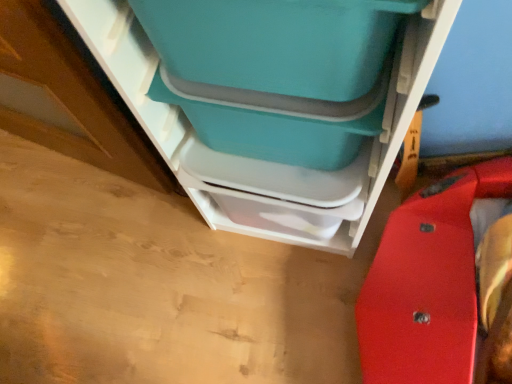
Question: Should I look upward or downward to see matte plastic storage container at center?

Choices:
 (A) down
 (B) up

Answer: (B)

Question: Can you confirm if teal plastic storage bin at upper center is shorter than matte plastic storage container at center?

Choices:
 (A) yes
 (B) no

Answer: (B)

Question: From the image's perspective, is teal plastic storage bin at upper center beneath matte plastic storage container at center?

Choices:
 (A) no
 (B) yes

Answer: (B)

Question: Considering the relative sizes of teal plastic storage bin at upper center and matte plastic storage container at center in the image provided, is teal plastic storage bin at upper center taller than matte plastic storage container at center?

Choices:
 (A) no
 (B) yes

Answer: (B)

Question: Is teal plastic storage bin at upper center at the right side of matte plastic storage container at center?

Choices:
 (A) yes
 (B) no

Answer: (A)

Question: Is teal plastic storage bin at upper center outside matte plastic storage container at center?

Choices:
 (A) yes
 (B) no

Answer: (A)

Question: Is the position of teal plastic storage bin at upper center less distant than that of matte plastic storage container at center?

Choices:
 (A) no
 (B) yes

Answer: (B)

Question: Can you confirm if matte plastic storage container at center is wider than teal plastic storage bin at upper center?

Choices:
 (A) no
 (B) yes

Answer: (A)

Question: Is matte plastic storage container at center looking in the opposite direction of teal plastic storage bin at upper center?

Choices:
 (A) no
 (B) yes

Answer: (B)

Question: Is matte plastic storage container at center directly adjacent to teal plastic storage bin at upper center?

Choices:
 (A) yes
 (B) no

Answer: (B)

Question: Is matte plastic storage container at center not close to teal plastic storage bin at upper center?

Choices:
 (A) no
 (B) yes

Answer: (A)

Question: From the image's perspective, is matte plastic storage container at center on top of teal plastic storage bin at upper center?

Choices:
 (A) no
 (B) yes

Answer: (B)

Question: Is matte plastic storage container at center closer to the viewer compared to teal plastic storage bin at upper center?

Choices:
 (A) yes
 (B) no

Answer: (B)

Question: From the image's perspective, is matte plastic storage container at center positioned above or below teal plastic storage bin at upper center?

Choices:
 (A) above
 (B) below

Answer: (A)